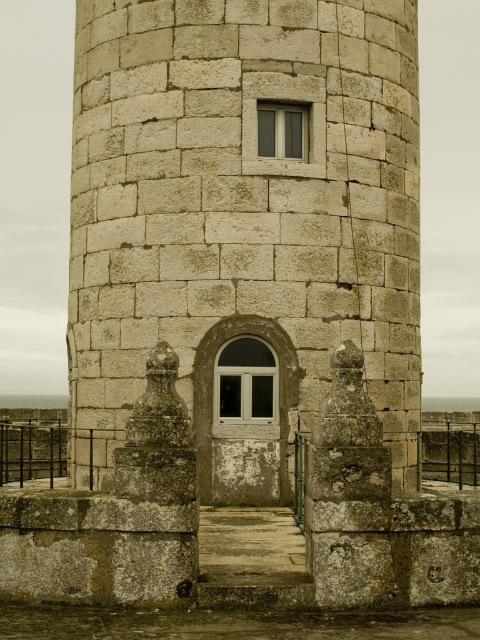
Question: Which object is farther from the camera taking this photo?

Choices:
 (A) stone textured tower at center
 (B) matte glass window at upper center

Answer: (B)

Question: Which point appears farthest from the camera in this image?

Choices:
 (A) (245, 396)
 (B) (131, 172)
 (C) (300, 156)

Answer: (B)

Question: Is stone textured tower at center to the left of white glass window at center from the viewer's perspective?

Choices:
 (A) yes
 (B) no

Answer: (A)

Question: Observing the image, what is the correct spatial positioning of stone textured tower at center in reference to white glass window at center?

Choices:
 (A) left
 (B) right

Answer: (A)

Question: Which point is farther to the camera?

Choices:
 (A) stone textured tower at center
 (B) matte glass window at upper center
 (C) white glass window at center

Answer: (B)

Question: Can you confirm if stone textured tower at center is smaller than white glass window at center?

Choices:
 (A) no
 (B) yes

Answer: (A)